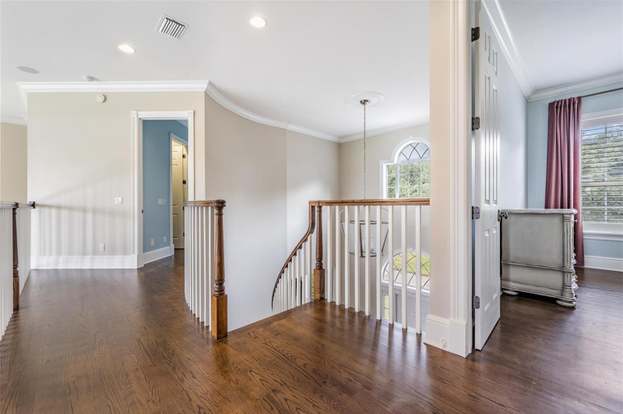
Find the location of a particular element. This screenshot has width=623, height=414. white wood railing posts is located at coordinates (357, 270), (364, 279), (377, 295).